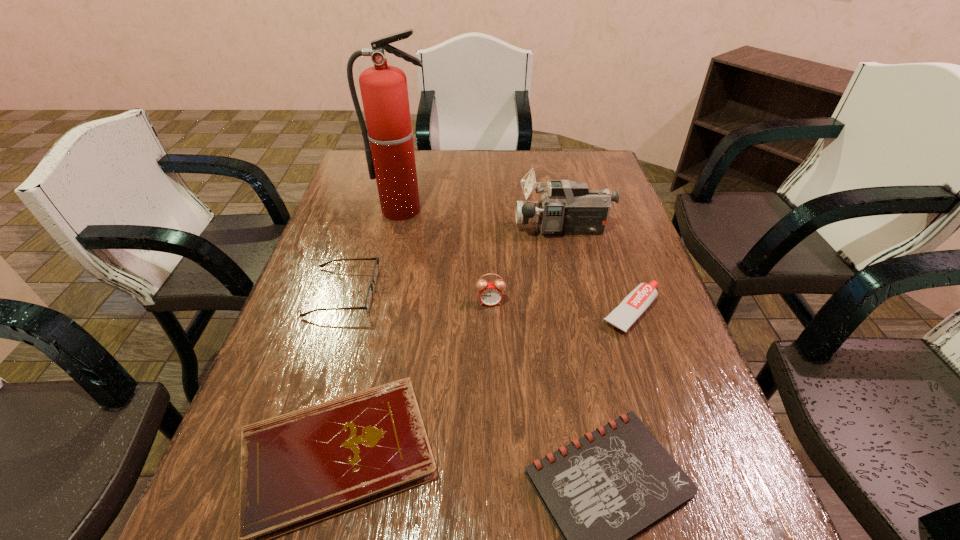
The image size is (960, 540). Find the location of `fire extinguisher`. fire extinguisher is located at coordinates (390, 156).

Locate an element on the screen. The width and height of the screenshot is (960, 540). camcorder is located at coordinates click(568, 207).

Locate an element on the screen. The width and height of the screenshot is (960, 540). the fourth object from right to left is located at coordinates (490, 293).

The width and height of the screenshot is (960, 540). Identify the location of alarm clock. (490, 293).

Find the location of `spectacles`. spectacles is located at coordinates (369, 296).

Locate an element on the screen. The image size is (960, 540). toothpaste is located at coordinates (635, 303).

The width and height of the screenshot is (960, 540). I want to click on free location located 0.360m with the nozzle and gauge on the fire extinguisher, so click(381, 310).

At what (x,y) coordinates should I click in order to perform the action: click on vacant space located 0.280m on the front-facing side of the camcorder. Please return your answer as a coordinate pair (x, y). The image size is (960, 540). Looking at the image, I should click on (420, 229).

I want to click on vacant area located 0.110m on the front-facing side of the camcorder, so click(x=478, y=229).

The width and height of the screenshot is (960, 540). In order to click on vacant space located 0.280m on the front-facing side of the camcorder in this screenshot , I will do `click(420, 229)`.